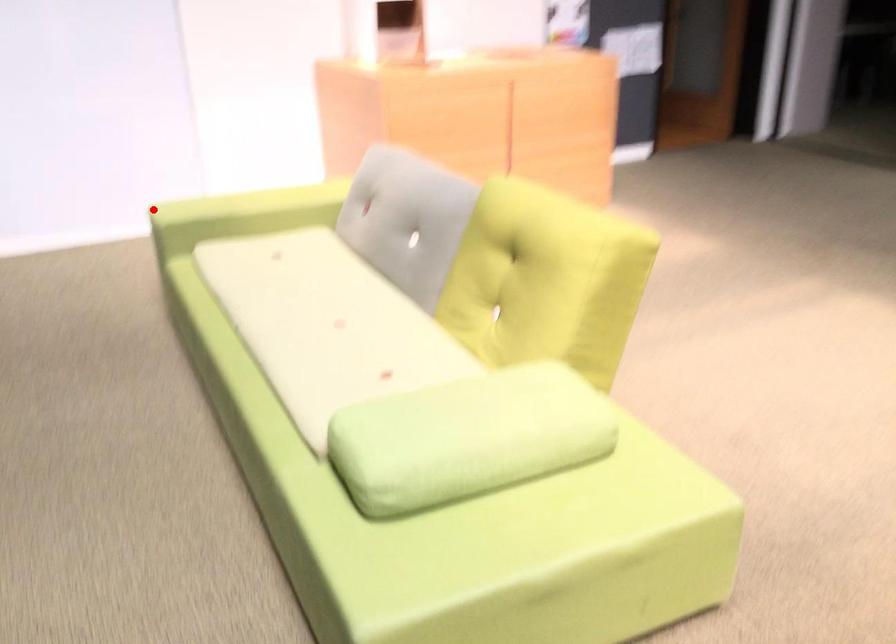
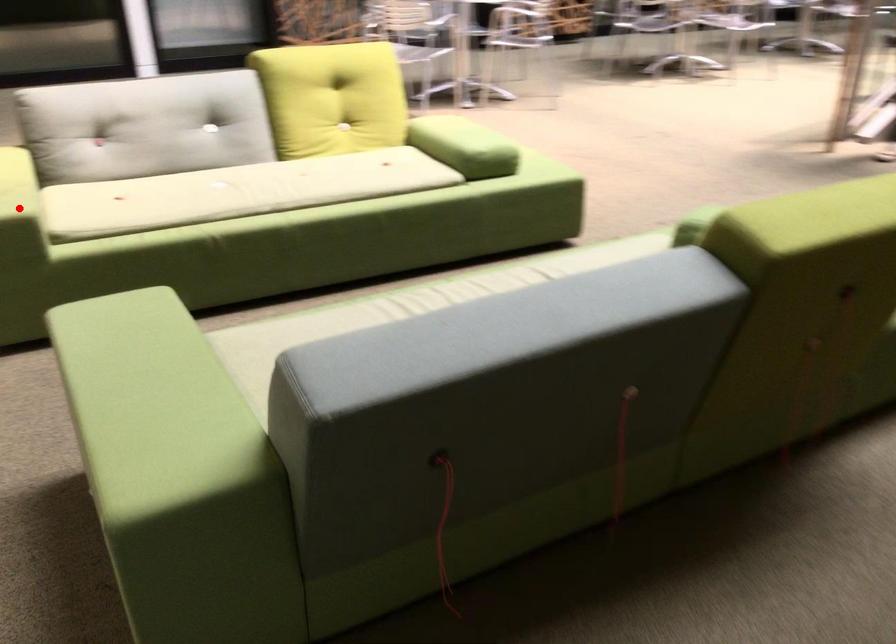
I am providing you with two images of the same scene from different viewpoints. A red point is marked on the first image and another point is marked on the second image. Do the highlighted points in image1 and image2 indicate the same real-world spot?

Yes